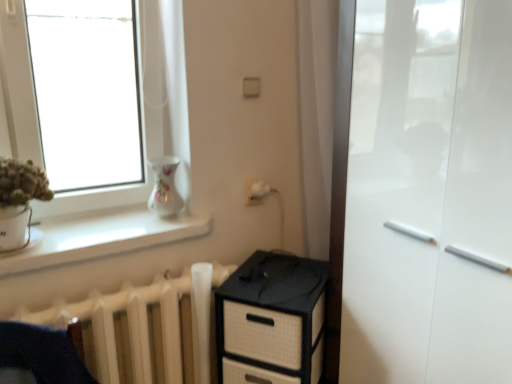
At what (x,y) coordinates should I click in order to perform the action: click on blank space situated above black woven chest of drawers at lower center (from a real-world perspective). Please return your answer as a coordinate pair (x, y). The width and height of the screenshot is (512, 384). Looking at the image, I should click on (266, 277).